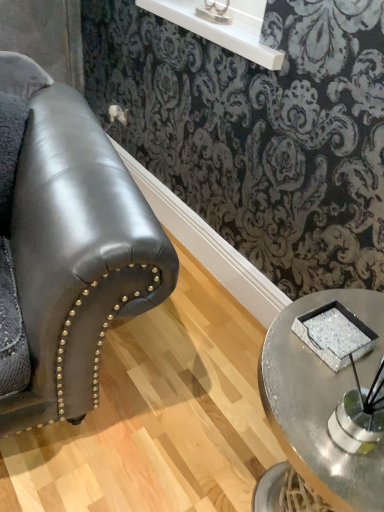
The height and width of the screenshot is (512, 384). What are the coordinates of `white glossy shelf at upper center` in the screenshot? It's located at (222, 26).

Measure the distance between metallic silver table lamp at upper center and camera.

metallic silver table lamp at upper center is 1.33 meters away from camera.

Identify the location of white glossy shelf at upper center. [222, 26].

Looking at their sizes, would you say metallic silver table lamp at upper center is wider or thinner than sparkly silver tray at center?

Considering their sizes, metallic silver table lamp at upper center looks slimmer than sparkly silver tray at center.

Between metallic silver table lamp at upper center and sparkly silver tray at center, which one has smaller size?

Smaller between the two is sparkly silver tray at center.

Which of these two, metallic silver table lamp at upper center or sparkly silver tray at center, stands shorter?

sparkly silver tray at center is shorter.

Can you confirm if metallic silver table lamp at upper center is positioned to the left of sparkly silver tray at center?

Indeed, metallic silver table lamp at upper center is positioned on the left side of sparkly silver tray at center.

Which is more to the right, sparkly silver tray at center or metallic silver table lamp at upper center?

From the viewer's perspective, sparkly silver tray at center appears more on the right side.

Which of these two, sparkly silver tray at center or metallic silver table lamp at upper center, is wider?

With larger width is sparkly silver tray at center.

Between sparkly silver tray at center and metallic silver table lamp at upper center, which one has more height?

metallic silver table lamp at upper center is taller.

Is sparkly silver tray at center next to metallic silver table lamp at upper center and touching it?

They are not placed beside each other.

In the scene shown: From a real-world perspective, is metallic silver tray at lower right located beneath white glossy shelf at upper center?

Yes, from a real-world perspective, metallic silver tray at lower right is beneath white glossy shelf at upper center.

From the image's perspective, which one is positioned lower, metallic silver tray at lower right or white glossy shelf at upper center?

metallic silver tray at lower right.

At what (x,y) coordinates should I click in order to perform the action: click on window sill that appears above the metallic silver tray at lower right (from the image's perspective). Please return your answer as a coordinate pair (x, y). The height and width of the screenshot is (512, 384). Looking at the image, I should click on (222, 26).

Who is more distant, metallic silver tray at lower right or white glossy shelf at upper center?

white glossy shelf at upper center.

Between white glossy shelf at upper center and sparkly silver tray at center, which one is positioned in front?

sparkly silver tray at center is in front.

Does point (256, 42) appear closer or farther from the camera than point (354, 327)?

Clearly, point (256, 42) is more distant from the camera than point (354, 327).

In order to click on window sill to the left of sparkly silver tray at center in this screenshot , I will do `click(222, 26)`.

How many degrees apart are the facing directions of white glossy shelf at upper center and sparkly silver tray at center?

1.64 degrees.

Which object is positioned more to the right, white glossy shelf at upper center or metallic silver tray at lower right?

metallic silver tray at lower right.

Considering the sizes of white glossy shelf at upper center and metallic silver tray at lower right in the image, is white glossy shelf at upper center wider or thinner than metallic silver tray at lower right?

Considering their sizes, white glossy shelf at upper center looks broader than metallic silver tray at lower right.

How distant is white glossy shelf at upper center from metallic silver tray at lower right?

white glossy shelf at upper center is 35.77 inches away from metallic silver tray at lower right.

Considering the relative sizes of white glossy shelf at upper center and metallic silver tray at lower right in the image provided, is white glossy shelf at upper center taller than metallic silver tray at lower right?

No, white glossy shelf at upper center is not taller than metallic silver tray at lower right.

Based on the photo, between metallic silver table lamp at upper center and white glossy shelf at upper center, which one is positioned in front?

white glossy shelf at upper center is in front.

Is metallic silver table lamp at upper center bigger than white glossy shelf at upper center?

No.

How many degrees apart are the facing directions of metallic silver table lamp at upper center and white glossy shelf at upper center?

The angular difference between metallic silver table lamp at upper center and white glossy shelf at upper center is 0.00213 degrees.

Between metallic silver table lamp at upper center and white glossy shelf at upper center, which one has smaller width?

metallic silver table lamp at upper center.

Is sparkly silver tray at center touching metallic silver tray at lower right?

Indeed, sparkly silver tray at center and metallic silver tray at lower right are beside each other and touching.

Does sparkly silver tray at center have a greater width compared to metallic silver tray at lower right?

In fact, sparkly silver tray at center might be narrower than metallic silver tray at lower right.

How many degrees apart are the facing directions of sparkly silver tray at center and metallic silver tray at lower right?

The facing directions of sparkly silver tray at center and metallic silver tray at lower right are 0.00255 degrees apart.

Is sparkly silver tray at center looking in the opposite direction of metallic silver tray at lower right?

sparkly silver tray at center does not have its back to metallic silver tray at lower right.

Find the location of `table lamp on the left of sparkly silver tray at center`. table lamp on the left of sparkly silver tray at center is located at coordinates (214, 12).

The height and width of the screenshot is (512, 384). I want to click on table lamp that appears above the sparkly silver tray at center (from the image's perspective), so click(214, 12).

Looking at the image, which one is located further to white glossy shelf at upper center, metallic silver table lamp at upper center or metallic silver tray at lower right?

Based on the image, metallic silver tray at lower right appears to be further to white glossy shelf at upper center.

When comparing their distances from metallic silver tray at lower right, does sparkly silver tray at center or metallic silver table lamp at upper center seem closer?

Based on the image, sparkly silver tray at center appears to be nearer to metallic silver tray at lower right.

Considering their positions, is metallic silver tray at lower right positioned further to white glossy shelf at upper center than metallic silver table lamp at upper center?

The object further to white glossy shelf at upper center is metallic silver tray at lower right.

Which object lies further to the anchor point sparkly silver tray at center, metallic silver tray at lower right or metallic silver table lamp at upper center?

Among the two, metallic silver table lamp at upper center is located further to sparkly silver tray at center.

Looking at the image, which one is located further to white glossy shelf at upper center, sparkly silver tray at center or metallic silver tray at lower right?

Based on the image, sparkly silver tray at center appears to be further to white glossy shelf at upper center.

In the scene shown: Which object lies further to the anchor point metallic silver table lamp at upper center, metallic silver tray at lower right or sparkly silver tray at center?

Among the two, metallic silver tray at lower right is located further to metallic silver table lamp at upper center.

Looking at this image, from the image, which object appears to be farther from metallic silver tray at lower right, metallic silver table lamp at upper center or sparkly silver tray at center?

Based on the image, metallic silver table lamp at upper center appears to be further to metallic silver tray at lower right.

Considering their positions, is sparkly silver tray at center positioned closer to metallic silver table lamp at upper center than metallic silver tray at lower right?

sparkly silver tray at center.

Find the location of `pad that lies between metallic silver table lamp at upper center and metallic silver tray at lower right from top to bottom`. pad that lies between metallic silver table lamp at upper center and metallic silver tray at lower right from top to bottom is located at coordinates (335, 334).

Where is `window sill between metallic silver table lamp at upper center and sparkly silver tray at center in the up-down direction`? This screenshot has height=512, width=384. window sill between metallic silver table lamp at upper center and sparkly silver tray at center in the up-down direction is located at coordinates (222, 26).

I want to click on pad between white glossy shelf at upper center and metallic silver tray at lower right in the vertical direction, so click(x=335, y=334).

This screenshot has height=512, width=384. What are the coordinates of `window sill that lies between metallic silver table lamp at upper center and metallic silver tray at lower right from top to bottom` in the screenshot? It's located at (222, 26).